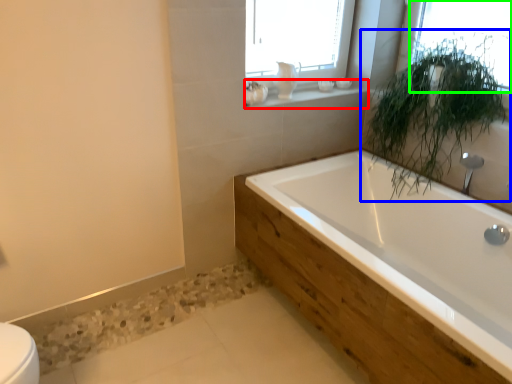
Question: Which object is the closest to the window sill (highlighted by a red box)? Choose among these: houseplant (highlighted by a blue box) or window (highlighted by a green box).

Choices:
 (A) houseplant
 (B) window

Answer: (A)